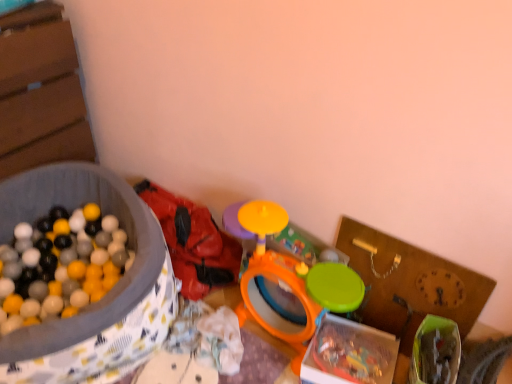
Measure the distance between point (194, 284) and camera.

The depth of point (194, 284) is 1.75 meters.

What is the approximate width of rubberized red backpack at center, arranged as the 2th toy when viewed from the right?

The width of rubberized red backpack at center, arranged as the 2th toy when viewed from the right, is 31.65 centimeters.

The height and width of the screenshot is (384, 512). Find the location of `translucent plastic box at center, positioned as the 2th box in left-to-right order`. translucent plastic box at center, positioned as the 2th box in left-to-right order is located at coordinates (349, 354).

Where is `wooden clock at right`? Image resolution: width=512 pixels, height=384 pixels. wooden clock at right is located at coordinates (409, 283).

Identify the location of rubberized red backpack at center, arranged as the 2th toy when viewed from the right. This screenshot has height=384, width=512. [193, 241].

Does point (276, 298) come behind point (215, 273)?

No, it is in front of (215, 273).

Is rubberized red backpack at center, which is counted as the 1th toy, starting from the left, surrounded by orange plastic drum at center, arranged as the 2th toy when viewed from the left?

Actually, rubberized red backpack at center, which is counted as the 1th toy, starting from the left, is outside orange plastic drum at center, arranged as the 2th toy when viewed from the left.

In the scene shown: Are orange plastic drum at center, the first toy viewed from the right, and rubberized red backpack at center, which is counted as the 1th toy, starting from the left, located far from each other?

No, orange plastic drum at center, the first toy viewed from the right, is in close proximity to rubberized red backpack at center, which is counted as the 1th toy, starting from the left.

In the image, is wooden clock at right on the left side or the right side of translucent plastic box at center, positioned as the 1th box in right-to-left order?

In the image, wooden clock at right appears on the right side of translucent plastic box at center, positioned as the 1th box in right-to-left order.

From the image's perspective, is wooden clock at right beneath translucent plastic box at center, positioned as the 1th box in right-to-left order?

No, from the image's perspective, wooden clock at right is not beneath translucent plastic box at center, positioned as the 1th box in right-to-left order.

Is wooden clock at right facing away from translucent plastic box at center, positioned as the 1th box in right-to-left order?

No, translucent plastic box at center, positioned as the 1th box in right-to-left order, is not at the back of wooden clock at right.

Is wooden clock at right inside the boundaries of translucent plastic box at center, positioned as the 2th box in left-to-right order, or outside?

The correct answer is: outside.

Considering the positions of objects translucent plastic box at center, positioned as the 1th box in right-to-left order, and wooden clock at right in the image provided, who is more to the right, translucent plastic box at center, positioned as the 1th box in right-to-left order, or wooden clock at right?

wooden clock at right.

In the scene shown: Which object is closer to the camera taking this photo, translucent plastic box at center, positioned as the 2th box in left-to-right order, or wooden clock at right?

wooden clock at right.

From a real-world perspective, which object stands above the other?

In real-world perspective, wooden clock at right is above.

From the image's perspective, between translucent plastic box at center, positioned as the 2th box in left-to-right order, and wooden clock at right, which one is located above?

From the image's view, wooden clock at right is above.

Considering the sizes of objects rubberized red backpack at center, arranged as the 2th toy when viewed from the right, and orange plastic drum at center, arranged as the 2th toy when viewed from the left, in the image provided, who is bigger, rubberized red backpack at center, arranged as the 2th toy when viewed from the right, or orange plastic drum at center, arranged as the 2th toy when viewed from the left,?

rubberized red backpack at center, arranged as the 2th toy when viewed from the right, is bigger.

Looking at this image, between rubberized red backpack at center, which is counted as the 1th toy, starting from the left, and orange plastic drum at center, arranged as the 2th toy when viewed from the left, which one has more height?

Standing taller between the two is orange plastic drum at center, arranged as the 2th toy when viewed from the left.

From the image's perspective, is rubberized red backpack at center, arranged as the 2th toy when viewed from the right, located beneath orange plastic drum at center, the first toy viewed from the right?

No.

At what (x,y) coordinates should I click in order to perform the action: click on toy in front of the rubberized red backpack at center, arranged as the 2th toy when viewed from the right. Please return your answer as a coordinate pair (x, y). This screenshot has width=512, height=384. Looking at the image, I should click on [x=275, y=283].

Based on the photo, from the image's perspective, is wooden clock at right on rubberized red backpack at center, arranged as the 2th toy when viewed from the right?

No.

Which of these two, wooden clock at right or rubberized red backpack at center, arranged as the 2th toy when viewed from the right, is smaller?

wooden clock at right.

In terms of width, does wooden clock at right look wider or thinner when compared to rubberized red backpack at center, which is counted as the 1th toy, starting from the left?

In the image, wooden clock at right appears to be more narrow than rubberized red backpack at center, which is counted as the 1th toy, starting from the left.

Is wooden clock at right closer to camera compared to rubberized red backpack at center, which is counted as the 1th toy, starting from the left?

Yes, it is in front of rubberized red backpack at center, which is counted as the 1th toy, starting from the left.

In the scene shown: Is rubberized red backpack at center, which is counted as the 1th toy, starting from the left, far from matte plastic ball pit at left, placed as the 2th box when sorted from right to left?

That's not correct — rubberized red backpack at center, which is counted as the 1th toy, starting from the left, is a little close to matte plastic ball pit at left, placed as the 2th box when sorted from right to left.

Is rubberized red backpack at center, which is counted as the 1th toy, starting from the left, facing away from matte plastic ball pit at left, placed as the 2th box when sorted from right to left?

No, rubberized red backpack at center, which is counted as the 1th toy, starting from the left,'s orientation is not away from matte plastic ball pit at left, placed as the 2th box when sorted from right to left.

Which box is the 2nd one when counting from the front of the rubberized red backpack at center, which is counted as the 1th toy, starting from the left? Please provide its 2D coordinates.

[(103, 297)]

Is wooden clock at right positioned with its back to matte plastic ball pit at left, placed as the 2th box when sorted from right to left?

No, matte plastic ball pit at left, placed as the 2th box when sorted from right to left, is not at the back of wooden clock at right.

Which of these two, wooden clock at right or matte plastic ball pit at left, arranged as the first box when viewed from the left, is thinner?

wooden clock at right is thinner.

Is wooden clock at right in front of or behind matte plastic ball pit at left, placed as the 2th box when sorted from right to left, in the image?

wooden clock at right is positioned farther from the viewer than matte plastic ball pit at left, placed as the 2th box when sorted from right to left.

Is wooden clock at right not near matte plastic ball pit at left, placed as the 2th box when sorted from right to left?

wooden clock at right is actually quite close to matte plastic ball pit at left, placed as the 2th box when sorted from right to left.

This screenshot has width=512, height=384. In order to click on toy above the rubberized red backpack at center, arranged as the 2th toy when viewed from the right (from a real-world perspective) in this screenshot , I will do `click(275, 283)`.

Where is `the 2nd box directly beneath the wooden clock at right (from a real-world perspective)`? This screenshot has width=512, height=384. the 2nd box directly beneath the wooden clock at right (from a real-world perspective) is located at coordinates click(x=349, y=354).

Based on their spatial positions, is translucent plastic box at center, positioned as the 2th box in left-to-right order, or matte plastic ball pit at left, placed as the 2th box when sorted from right to left, further from wooden clock at right?

matte plastic ball pit at left, placed as the 2th box when sorted from right to left, lies further to wooden clock at right than the other object.

Which object lies further to the anchor point wooden clock at right, orange plastic drum at center, the first toy viewed from the right, or matte plastic ball pit at left, arranged as the first box when viewed from the left?

matte plastic ball pit at left, arranged as the first box when viewed from the left, is positioned further to the anchor wooden clock at right.

From the image, which object appears to be farther from matte plastic ball pit at left, arranged as the first box when viewed from the left, orange plastic drum at center, the first toy viewed from the right, or rubberized red backpack at center, arranged as the 2th toy when viewed from the right?

orange plastic drum at center, the first toy viewed from the right, lies further to matte plastic ball pit at left, arranged as the first box when viewed from the left, than the other object.

Which object lies nearer to the anchor point matte plastic ball pit at left, placed as the 2th box when sorted from right to left, rubberized red backpack at center, arranged as the 2th toy when viewed from the right, or orange plastic drum at center, the first toy viewed from the right?

The object closer to matte plastic ball pit at left, placed as the 2th box when sorted from right to left, is rubberized red backpack at center, arranged as the 2th toy when viewed from the right.

Looking at this image, which object lies nearer to the anchor point translucent plastic box at center, positioned as the 1th box in right-to-left order, matte plastic ball pit at left, arranged as the first box when viewed from the left, or orange plastic drum at center, the first toy viewed from the right?

orange plastic drum at center, the first toy viewed from the right, is positioned closer to the anchor translucent plastic box at center, positioned as the 1th box in right-to-left order.

When comparing their distances from translucent plastic box at center, positioned as the 1th box in right-to-left order, does wooden clock at right or rubberized red backpack at center, which is counted as the 1th toy, starting from the left, seem further?

rubberized red backpack at center, which is counted as the 1th toy, starting from the left, is positioned further to the anchor translucent plastic box at center, positioned as the 1th box in right-to-left order.

Looking at this image, when comparing their distances from orange plastic drum at center, arranged as the 2th toy when viewed from the left, does translucent plastic box at center, positioned as the 1th box in right-to-left order, or rubberized red backpack at center, arranged as the 2th toy when viewed from the right, seem further?

Among the two, rubberized red backpack at center, arranged as the 2th toy when viewed from the right, is located further to orange plastic drum at center, arranged as the 2th toy when viewed from the left.

Estimate the real-world distances between objects in this image. Which object is further from translucent plastic box at center, positioned as the 1th box in right-to-left order, orange plastic drum at center, arranged as the 2th toy when viewed from the left, or matte plastic ball pit at left, arranged as the first box when viewed from the left?

The object further to translucent plastic box at center, positioned as the 1th box in right-to-left order, is matte plastic ball pit at left, arranged as the first box when viewed from the left.

Where is `toy situated between rubberized red backpack at center, which is counted as the 1th toy, starting from the left, and translucent plastic box at center, positioned as the 2th box in left-to-right order, from left to right`? This screenshot has width=512, height=384. toy situated between rubberized red backpack at center, which is counted as the 1th toy, starting from the left, and translucent plastic box at center, positioned as the 2th box in left-to-right order, from left to right is located at coordinates (275, 283).

Find the location of a particular element. Image resolution: width=512 pixels, height=384 pixels. box between orange plastic drum at center, the first toy viewed from the right, and wooden clock at right is located at coordinates (349, 354).

Where is `box between rubberized red backpack at center, arranged as the 2th toy when viewed from the right, and wooden clock at right`? box between rubberized red backpack at center, arranged as the 2th toy when viewed from the right, and wooden clock at right is located at coordinates (349, 354).

Locate an element on the screen. The width and height of the screenshot is (512, 384). toy located between matte plastic ball pit at left, arranged as the first box when viewed from the left, and orange plastic drum at center, the first toy viewed from the right, in the left-right direction is located at coordinates (193, 241).